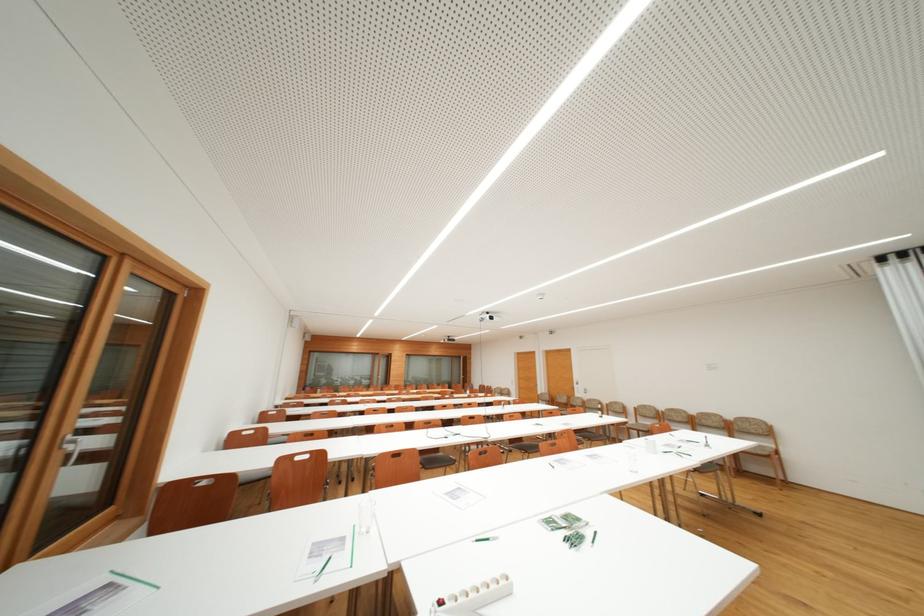
Describe the element at coordinates (365, 516) in the screenshot. I see `a clear drinking glass` at that location.